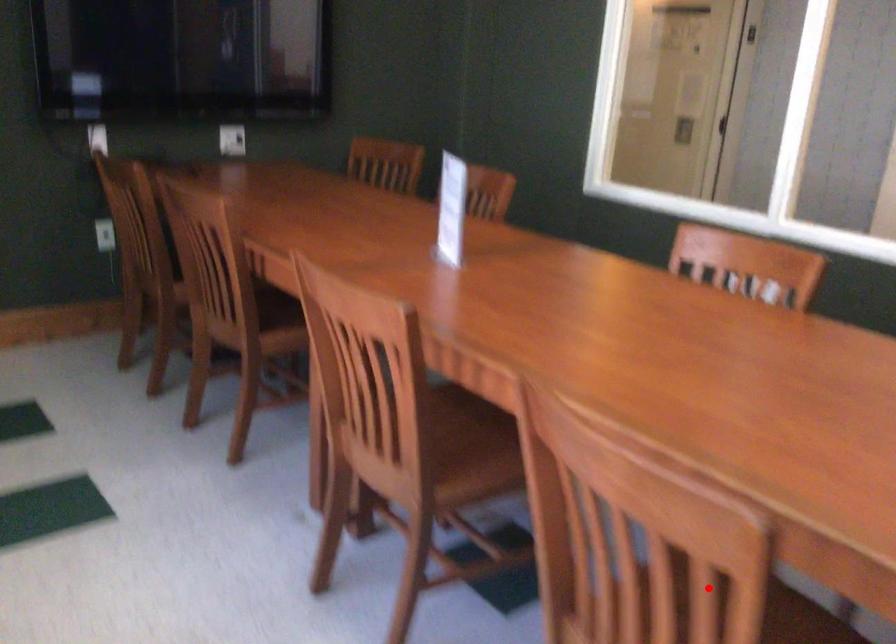
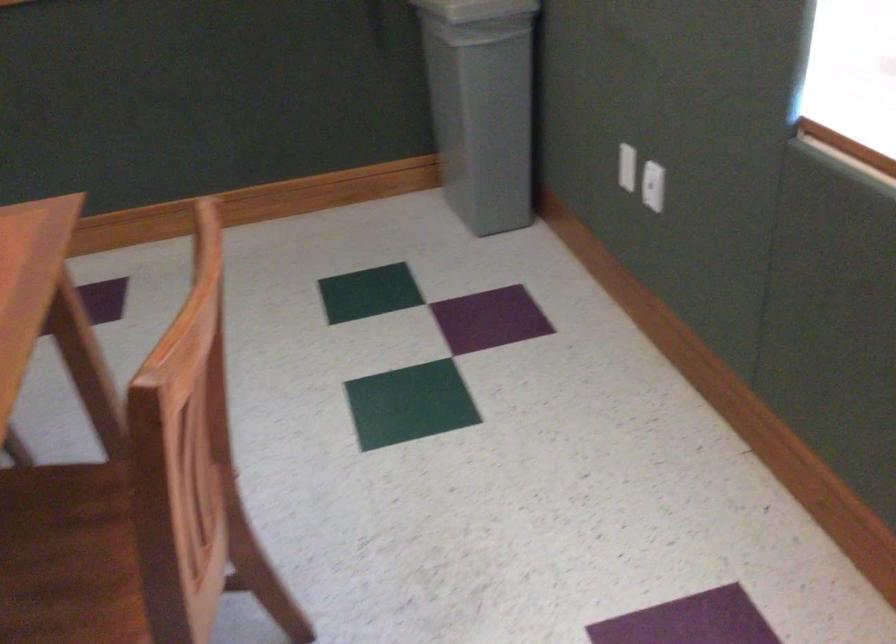
Question: I am providing you with two images of the same scene from different viewpoints. A red point is marked on the first image. Can you still see the location of the red point in image 2?

Choices:
 (A) Yes
 (B) No

Answer: (B)